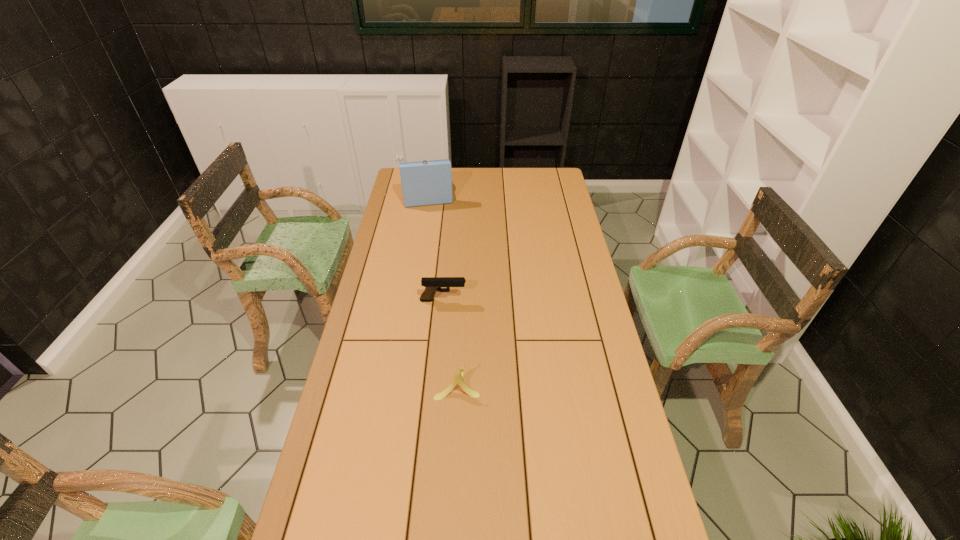
I want to click on vacant space that satisfies the following two spatial constraints: 1. on the back side of the nearest object; 2. on the front-facing side of the second farthest object, so click(x=461, y=300).

At what (x,y) coordinates should I click in order to perform the action: click on free space that satisfies the following two spatial constraints: 1. on the back side of the banana; 2. on the front-facing side of the pistol. Please return your answer as a coordinate pair (x, y). The height and width of the screenshot is (540, 960). Looking at the image, I should click on (461, 300).